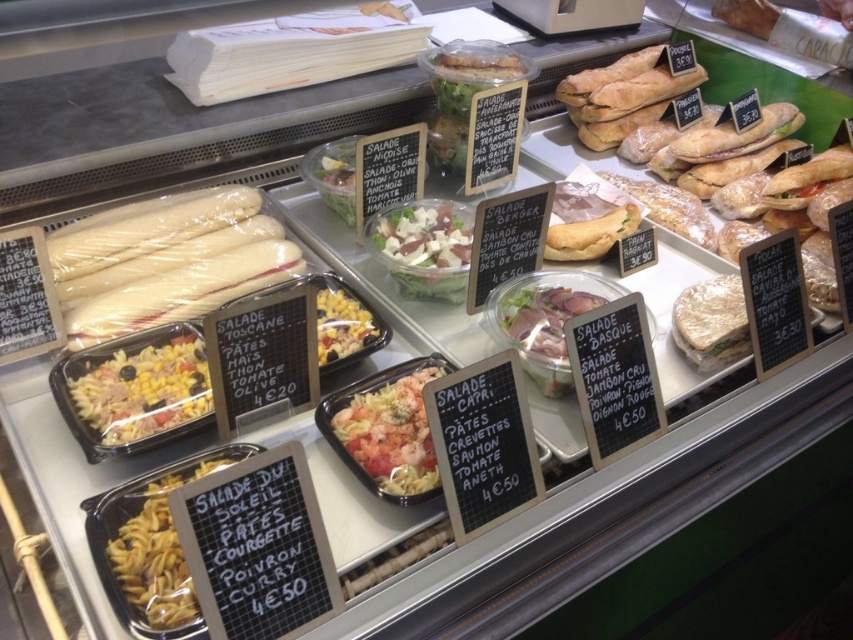
You are a customer in the deli section and want to grab both the shiny plastic container of pasta salad at center and the matte brown salad at center. Which one should you pick up first to avoid blocking the view of the other?

You should pick up the shiny plastic container of pasta salad at center first because it is located below the matte brown salad at center, so picking it up first would prevent blocking the view of the matte brown salad at center.

You are a customer looking at the display case in the deli section. You want to grab the shiny plastic container of pasta salad at center and the matte brown salad at center. Which one do you need to reach into the case first to pick up?

The shiny plastic container of pasta salad at center is in front of the matte brown salad at center, so you should reach for the shiny plastic container of pasta salad at center first.

You are a customer at the deli counter. You want to pick up the shiny metallic salad bowl at center but need to reach it from the yellowish matte pasta at left. Is there any obstacle in the way?

The yellowish matte pasta at left is positioned under the shiny metallic salad bowl at center, so you can easily reach the shiny metallic salad bowl at center without any obstruction since it is above the yellowish matte pasta at left.